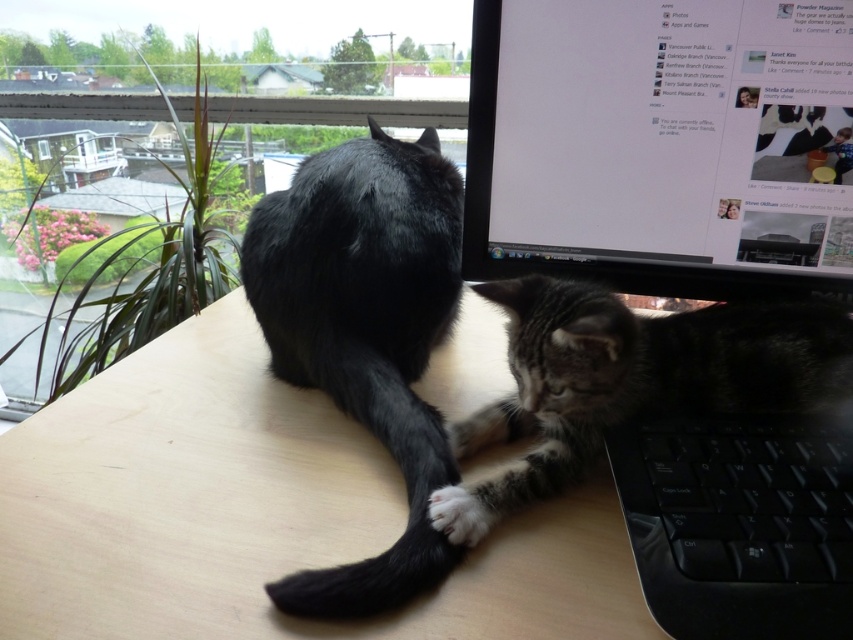
You are standing 20 inches away from the desk. There is a point at coordinates point (811, 1). Can you reach that point without moving closer to the desk?

The distance of point (811, 1) from viewer is 21.71 inches. Since you are currently 20 inches away from the desk, you are 1.71 inches too far to reach the point without moving closer.

You are a small toy mouse that is 10 cm tall. You want to hide under the wooden table at center so that the tabby fur cat at lower right cannot see you. Is this possible?

The wooden table at center has a greater height compared to tabby fur cat at lower right, so yes, the toy mouse can hide under the wooden table at center because it is tall enough to provide concealment from the cat.

You are trying to place a 1.5 foot wide decorative item on the wooden table at center. Considering the space occupied by the tabby fur cat at lower right, will there be enough room for the item?

The wooden table at center is larger in size than the tabby fur cat at lower right, so there should be enough space to place the 1.5 foot wide decorative item on the wooden table at center without overlapping the cat.